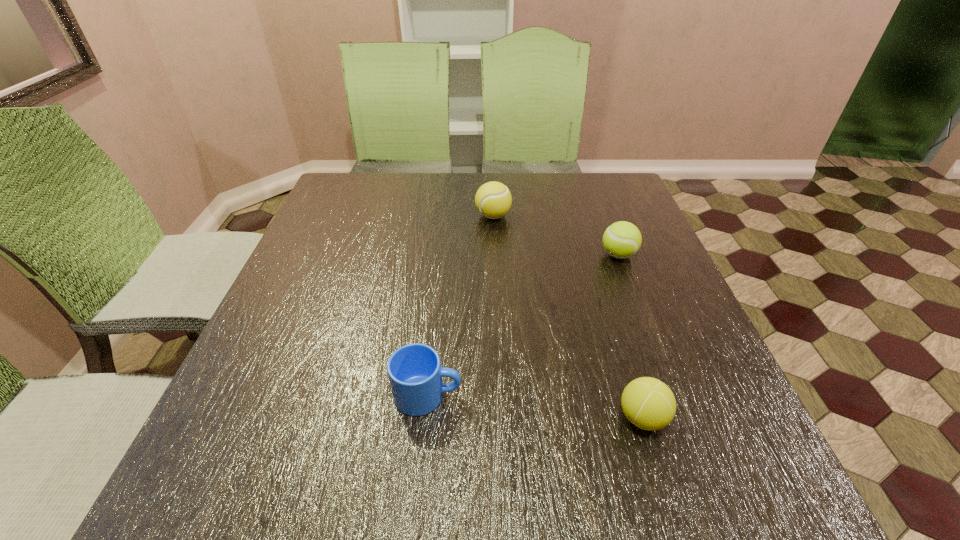
This screenshot has height=540, width=960. Find the location of `free space at the far edge`. free space at the far edge is located at coordinates (396, 182).

Locate an element on the screen. Image resolution: width=960 pixels, height=540 pixels. free space at the near edge is located at coordinates (376, 487).

In the image, there is a desktop. Where is `vacant space at the left edge`? Image resolution: width=960 pixels, height=540 pixels. vacant space at the left edge is located at coordinates (359, 232).

Locate an element on the screen. This screenshot has height=540, width=960. vacant space at the right edge of the desktop is located at coordinates (689, 377).

Locate an element on the screen. vacant space at the far left corner of the desktop is located at coordinates (349, 179).

The image size is (960, 540). I want to click on vacant space at the far right corner of the desktop, so click(589, 178).

Where is `vacant point at the near right corner`? This screenshot has width=960, height=540. vacant point at the near right corner is located at coordinates click(x=778, y=507).

Find the location of a particular element. vacant space in between the nearest tennis ball and the second farthest object is located at coordinates click(x=631, y=336).

Where is `free space between the nearest tennis ball and the mug`? This screenshot has height=540, width=960. free space between the nearest tennis ball and the mug is located at coordinates (535, 406).

Identify the location of free spot between the mug and the nearest tennis ball. The height and width of the screenshot is (540, 960). (535, 406).